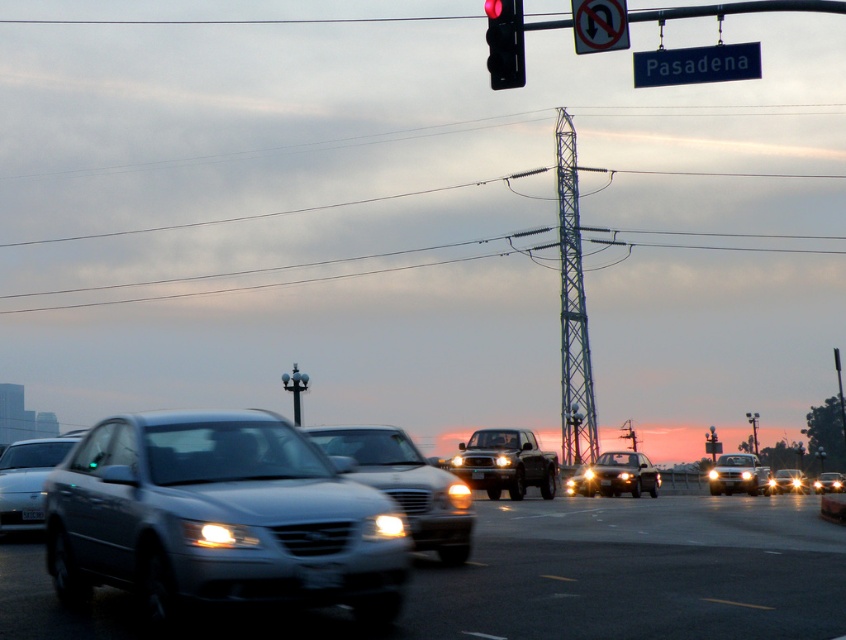
From the picture: Between sleek silver sedan at center and black plastic license plate at center, which one has more height?

With more height is sleek silver sedan at center.

Can you confirm if sleek silver sedan at center is shorter than black plastic license plate at center?

No, sleek silver sedan at center is not shorter than black plastic license plate at center.

Find the location of `sleek silver sedan at center`. sleek silver sedan at center is located at coordinates (405, 484).

Which is behind, point (636, 472) or point (481, 477)?

Point (636, 472)

Is shiny black suv at center above black plastic license plate at center?

No, shiny black suv at center is not above black plastic license plate at center.

Does point (592, 465) come in front of point (475, 472)?

No, (592, 465) is behind (475, 472).

Identify the location of shiny black suv at center. (624, 474).

Who is more distant from viewer, [228,582] or [585,1]?

The point [585,1] is more distant.

Is satin silver sedan at center below black plastic no u-turn sign at upper center?

Correct, satin silver sedan at center is located below black plastic no u-turn sign at upper center.

Identify the location of satin silver sedan at center. This screenshot has width=846, height=640. (218, 518).

This screenshot has width=846, height=640. Find the location of `satin silver sedan at center`. satin silver sedan at center is located at coordinates point(218,518).